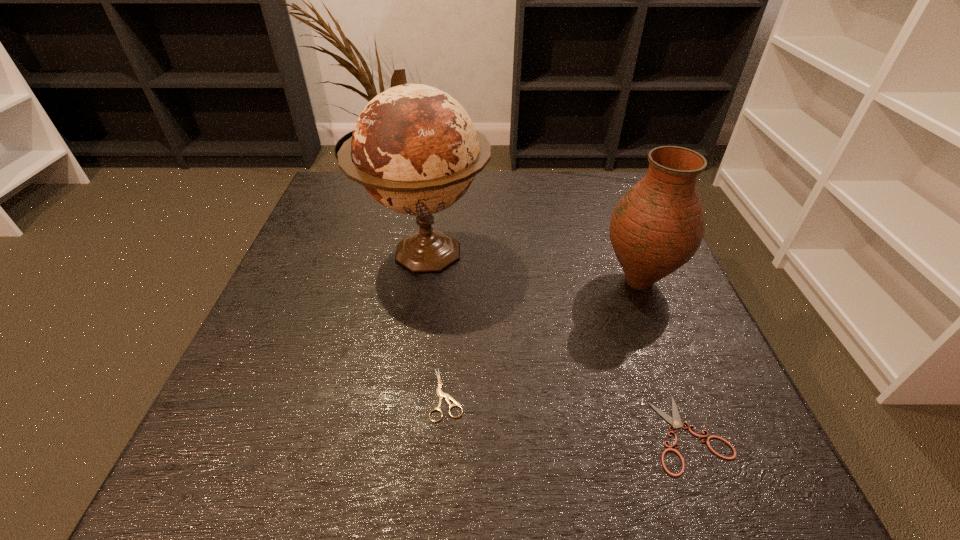
Find the location of a particular element. object situated at the left edge is located at coordinates (414, 148).

Identify the location of vase located in the right edge section of the desktop. The width and height of the screenshot is (960, 540). (658, 225).

Where is `shears situated at the right edge`? The image size is (960, 540). shears situated at the right edge is located at coordinates (676, 423).

At what (x,y) coordinates should I click in order to perform the action: click on object at the far left corner. Please return your answer as a coordinate pair (x, y). Looking at the image, I should click on (414, 148).

The width and height of the screenshot is (960, 540). Identify the location of object at the near right corner. (676, 423).

The image size is (960, 540). What are the coordinates of `free space at the far edge of the desktop` in the screenshot? It's located at (x=505, y=191).

In the image, there is a desktop. Find the location of `vacant space at the near edge`. vacant space at the near edge is located at coordinates (x=324, y=476).

In order to click on free space at the left edge in this screenshot , I will do `click(309, 259)`.

In order to click on free location at the right edge of the desktop in this screenshot , I will do `click(669, 391)`.

This screenshot has height=540, width=960. I want to click on vacant point at the near left corner, so click(296, 459).